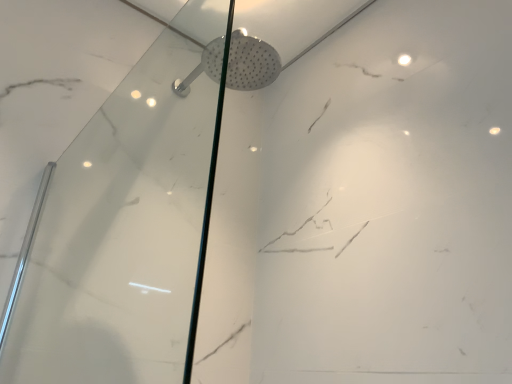
Where is `transparent glass screen door at upper left`? This screenshot has height=384, width=512. transparent glass screen door at upper left is located at coordinates (121, 235).

Measure the distance between transparent glass screen door at upper left and camera.

transparent glass screen door at upper left is 34.32 inches from camera.

Image resolution: width=512 pixels, height=384 pixels. Describe the element at coordinates (121, 235) in the screenshot. I see `transparent glass screen door at upper left` at that location.

Where is `transparent glass screen door at upper left`? The width and height of the screenshot is (512, 384). transparent glass screen door at upper left is located at coordinates (121, 235).